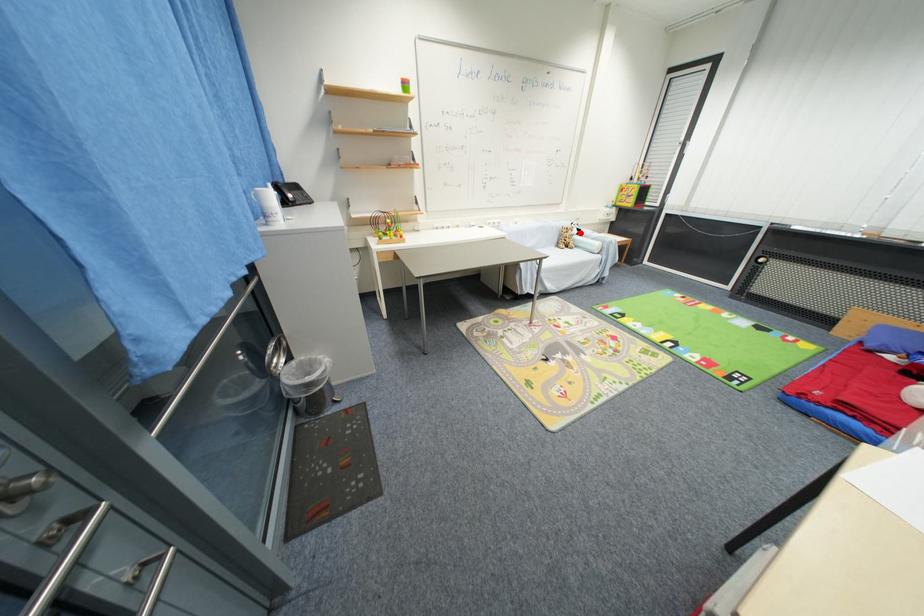
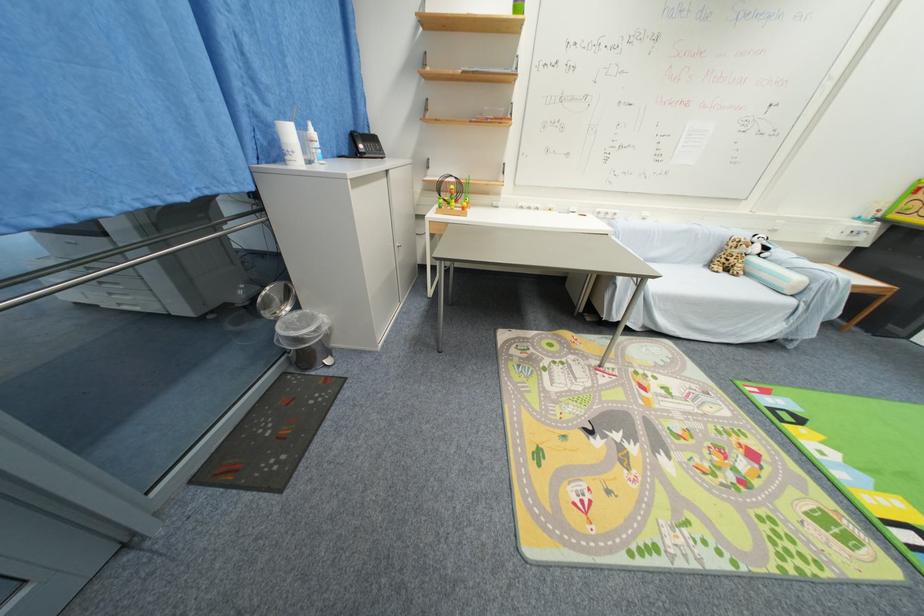
The point at the highlighted location is marked in the first image. Where is the corresponding point in the second image?

(761, 251)